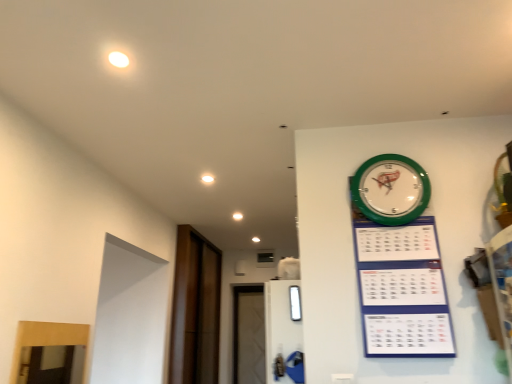
Question: Is transparent glass window at center in front of or behind white glossy light at upper center in the image?

Choices:
 (A) front
 (B) behind

Answer: (A)

Question: From the image's perspective, relative to white glossy light at upper center, is transparent glass window at center above or below?

Choices:
 (A) below
 (B) above

Answer: (A)

Question: Which object is positioned closest to the white glossy light at upper center?

Choices:
 (A) green plastic calendar at upper right
 (B) brown wood door at left
 (C) green plastic wall clock at upper right
 (D) transparent glass window at center

Answer: (D)

Question: Which object is the closest to the green plastic wall clock at upper right?

Choices:
 (A) brown wood door at left
 (B) white glossy light at upper center
 (C) transparent glass window at center
 (D) green plastic calendar at upper right

Answer: (D)